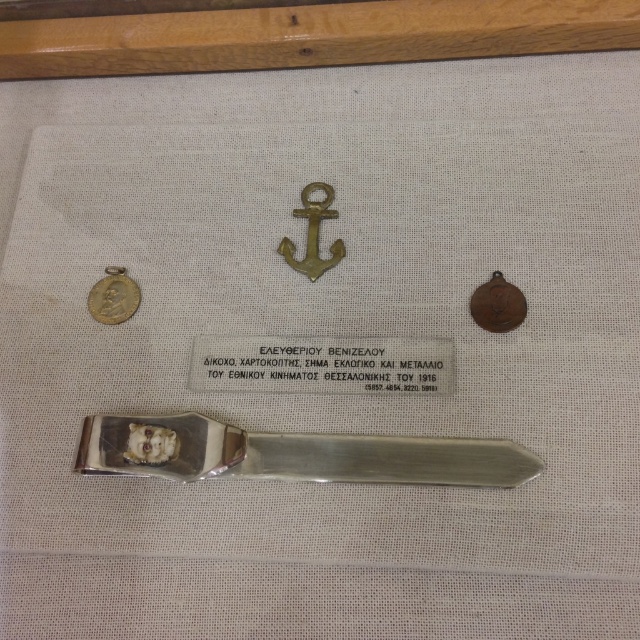
Looking at this image, who is shorter, silver metallic letter opener at center or gold plated coin at left?

gold plated coin at left

Is silver metallic letter opener at center to the left of gold plated coin at left from the viewer's perspective?

In fact, silver metallic letter opener at center is to the right of gold plated coin at left.

Describe the element at coordinates (292, 452) in the screenshot. This screenshot has width=640, height=640. I see `silver metallic letter opener at center` at that location.

Identify the location of silver metallic letter opener at center. (292, 452).